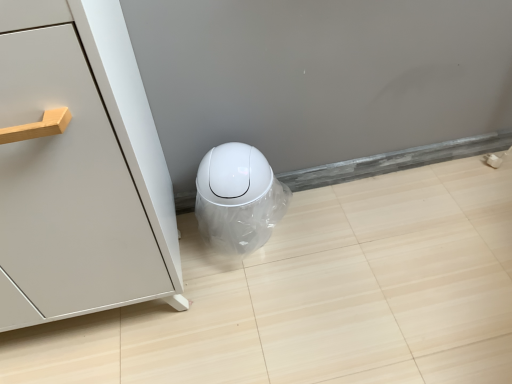
Question: Is matte white cabinet at left wider than white glossy trash can at lower center?

Choices:
 (A) yes
 (B) no

Answer: (A)

Question: Would you say matte white cabinet at left is outside white glossy trash can at lower center?

Choices:
 (A) yes
 (B) no

Answer: (A)

Question: Is matte white cabinet at left in front of white glossy trash can at lower center?

Choices:
 (A) no
 (B) yes

Answer: (B)

Question: Is matte white cabinet at left at the right side of white glossy trash can at lower center?

Choices:
 (A) yes
 (B) no

Answer: (B)

Question: Is matte white cabinet at left aimed at white glossy trash can at lower center?

Choices:
 (A) yes
 (B) no

Answer: (B)

Question: Considering the relative sizes of matte white cabinet at left and white glossy trash can at lower center in the image provided, is matte white cabinet at left thinner than white glossy trash can at lower center?

Choices:
 (A) no
 (B) yes

Answer: (A)

Question: Can we say white glossy trash can at lower center lies outside matte white cabinet at left?

Choices:
 (A) yes
 (B) no

Answer: (A)

Question: Does white glossy trash can at lower center have a greater width compared to matte white cabinet at left?

Choices:
 (A) no
 (B) yes

Answer: (A)

Question: Considering the relative sizes of white glossy trash can at lower center and matte white cabinet at left in the image provided, is white glossy trash can at lower center smaller than matte white cabinet at left?

Choices:
 (A) no
 (B) yes

Answer: (B)

Question: From a real-world perspective, is white glossy trash can at lower center on top of matte white cabinet at left?

Choices:
 (A) yes
 (B) no

Answer: (B)

Question: Is white glossy trash can at lower center positioned with its back to matte white cabinet at left?

Choices:
 (A) no
 (B) yes

Answer: (A)

Question: Does white glossy trash can at lower center have a greater height compared to matte white cabinet at left?

Choices:
 (A) yes
 (B) no

Answer: (B)

Question: Relative to white glossy trash can at lower center, is matte white cabinet at left in front or behind?

Choices:
 (A) front
 (B) behind

Answer: (A)